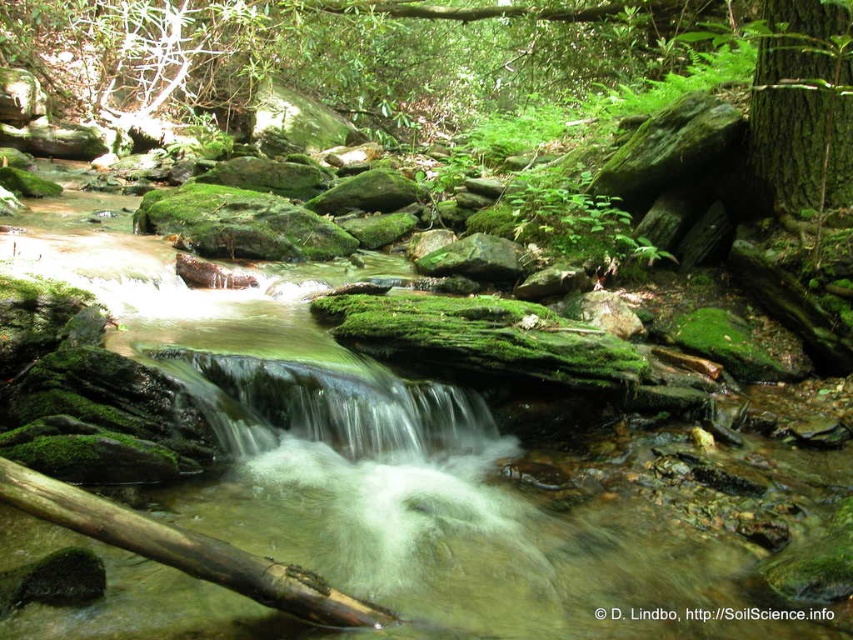
You are a hiker who wants to cross the stream using the brown rough log at lower center. There is a green rough bark tree at upper right nearby. Which direction should you walk from the log to avoid the tree?

The green rough bark tree at upper right is positioned on the right side of brown rough log at lower center. To avoid the tree, you should walk to the left side of the brown rough log at lower center.

You are a hiker who wants to take a photo of the green rough bark tree at upper right and the brown rough log at lower center. Which object should you focus on first if you want to capture both in a single frame without moving the camera?

You should focus on the green rough bark tree at upper right first because it is much taller than the brown rough log at lower center, so it will occupy more space in the frame and ensure proper composition.

You are a hiker who wants to cross the stream. You see the green rough bark tree at upper right and the brown rough log at lower center. Which object is higher up in the scene?

The green rough bark tree at upper right is above the brown rough log at lower center, so it is higher up in the scene.